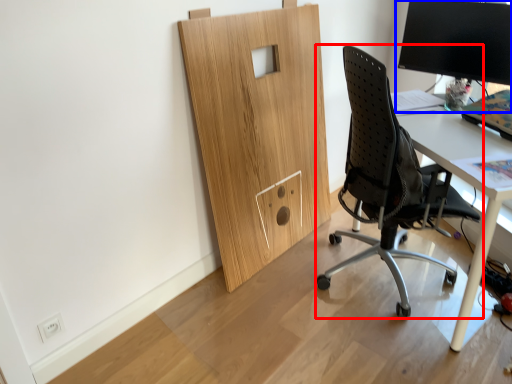
Question: Which object is closer to the camera taking this photo, chair (highlighted by a red box) or desktop computer (highlighted by a blue box)?

Choices:
 (A) chair
 (B) desktop computer

Answer: (A)